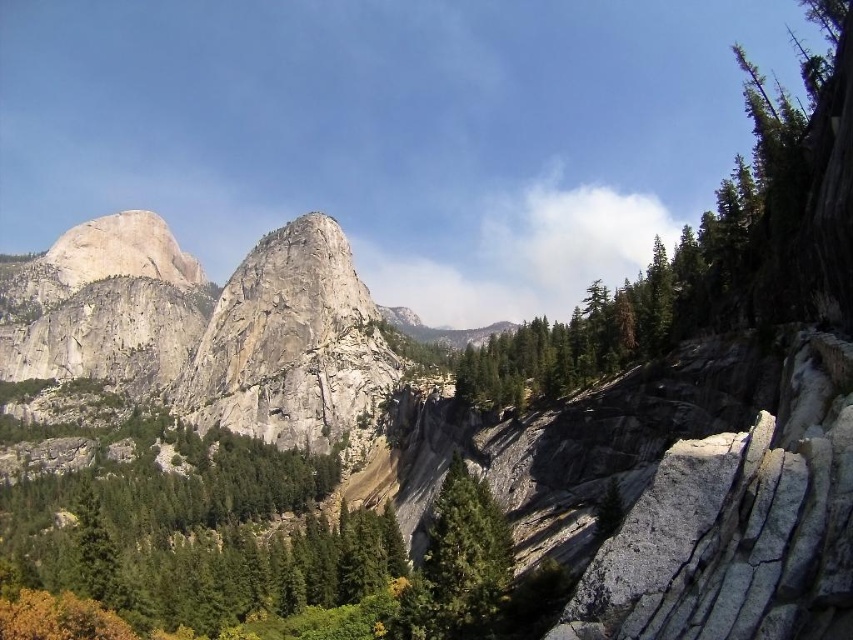
Is point (225, 376) positioned behind point (434, 596)?

Yes, it is behind point (434, 596).

Locate an element on the screen. gray/rough rock formation at center is located at coordinates (289, 344).

Who is more forward, (x=494, y=387) or (x=491, y=563)?

Point (x=491, y=563)

Is green textured rock at upper right below green textured tree at center?

No, green textured rock at upper right is not below green textured tree at center.

Locate an element on the screen. green textured rock at upper right is located at coordinates (711, 250).

Is green textured rock at upper right closer to camera compared to gray/rough rock formation at center?

Yes, it is in front of gray/rough rock formation at center.

Between green textured rock at upper right and gray/rough rock formation at center, which one appears on the left side from the viewer's perspective?

→ gray/rough rock formation at center

Between point (670, 260) and point (271, 305), which one is positioned behind?

Positioned behind is point (271, 305).

Locate an element on the screen. green textured rock at upper right is located at coordinates (711, 250).